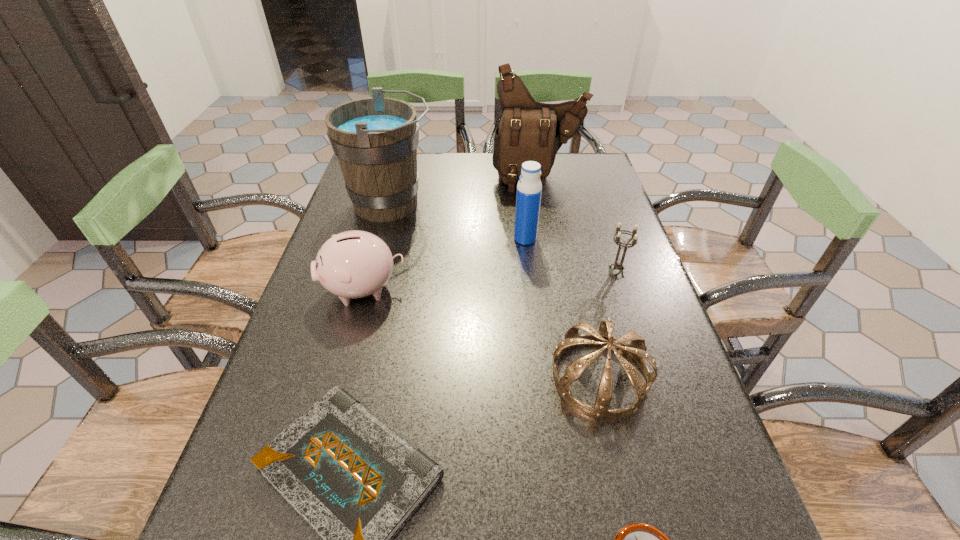
In order to click on blank space located 0.280m on the back of the piggy bank in this screenshot , I will do `click(387, 204)`.

Find the location of a particular element. This screenshot has height=540, width=960. free space located 0.080m on the left of the candle holder is located at coordinates (572, 272).

Where is `free location located on the front of the tiara`? This screenshot has width=960, height=540. free location located on the front of the tiara is located at coordinates (624, 478).

Where is `shoulder bag that is at the far edge`? This screenshot has height=540, width=960. shoulder bag that is at the far edge is located at coordinates (528, 130).

The height and width of the screenshot is (540, 960). Identify the location of wine bucket at the far edge. (375, 140).

The width and height of the screenshot is (960, 540). I want to click on wine bucket located in the left edge section of the desktop, so click(375, 140).

At what (x,y) coordinates should I click in order to perform the action: click on piggy bank at the left edge. Please return your answer as a coordinate pair (x, y). Looking at the image, I should click on (353, 264).

Identify the location of shoulder bag located at the right edge. This screenshot has height=540, width=960. (528, 130).

At what (x,y) coordinates should I click in order to perform the action: click on candle holder that is at the right edge. Please return your answer as a coordinate pair (x, y). Looking at the image, I should click on (618, 266).

Where is `tiara present at the right edge`? This screenshot has width=960, height=540. tiara present at the right edge is located at coordinates (636, 349).